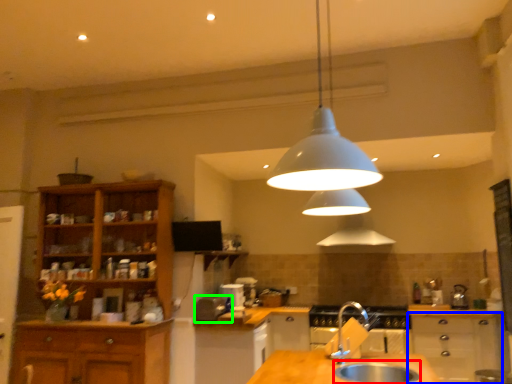
Question: Based on their relative distances, which object is farther from sink (highlighted by a red box)? Choose from cabinetry (highlighted by a blue box) and appliance (highlighted by a green box).

Choices:
 (A) cabinetry
 (B) appliance

Answer: (A)